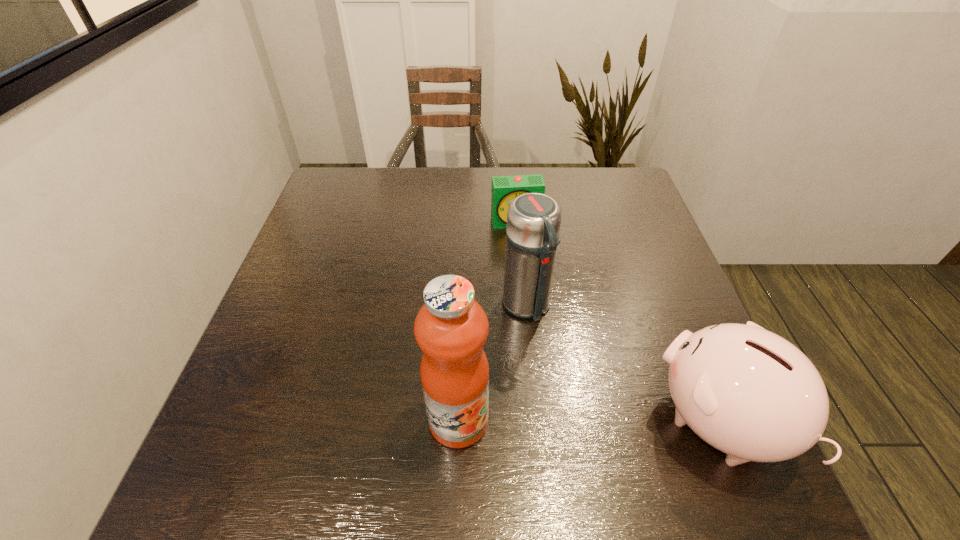
This screenshot has width=960, height=540. In order to click on free spot between the fruit juice and the thermos bottle in this screenshot , I will do `click(492, 363)`.

You are a GUI agent. You are given a task and a screenshot of the screen. Output one action in this format:
    pyautogui.click(x=<x>, y=<y>)
    Task: Click on the object that is the second closest one to the piggy bank
    The width and height of the screenshot is (960, 540).
    Given the screenshot: What is the action you would take?
    pyautogui.click(x=451, y=328)

Find the location of a particular element. object that is the third closest one to the second tallest object is located at coordinates (504, 189).

Locate an element on the screen. This screenshot has width=960, height=540. vacant space that satisfies the following two spatial constraints: 1. on the front label of the leftmost object; 2. on the left side of the second shortest object is located at coordinates (459, 421).

Locate an element on the screen. vacant space that satisfies the following two spatial constraints: 1. on the front side of the rightmost object; 2. on the left side of the second tallest object is located at coordinates (537, 421).